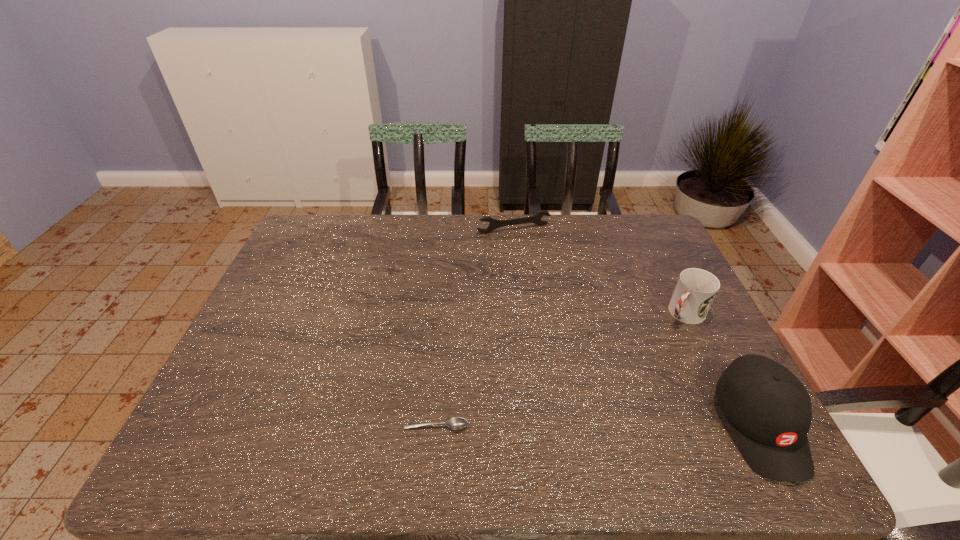
The height and width of the screenshot is (540, 960). In order to click on vacant space on the desktop that is between the soupspoon and the baseball cap and is positioned on the side of the second farthest object where the handle is located in this screenshot , I will do `click(569, 426)`.

Locate an element on the screen. Image resolution: width=960 pixels, height=540 pixels. vacant space on the desktop that is between the shortest object and the baseball cap and is positioned on the open ends of the second shortest object is located at coordinates (612, 426).